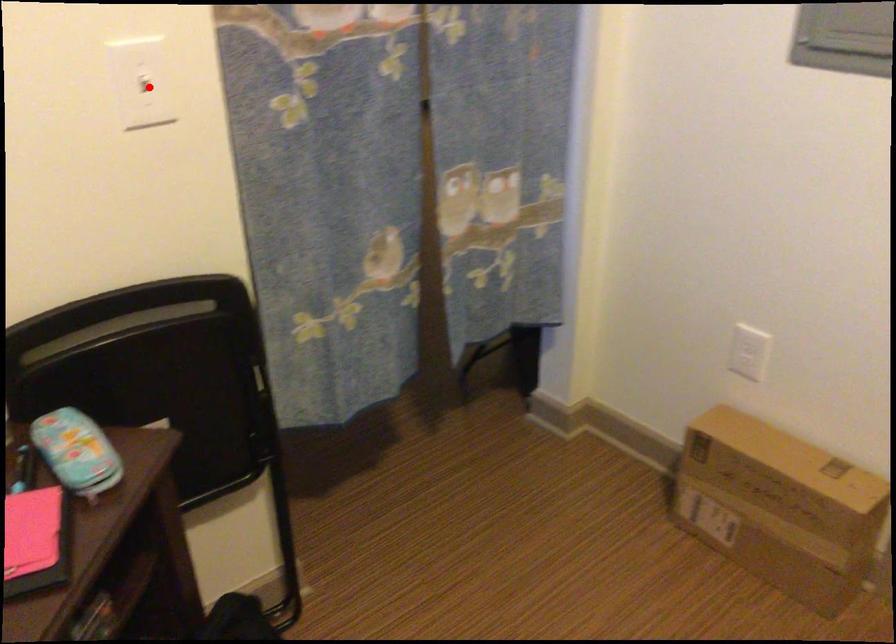
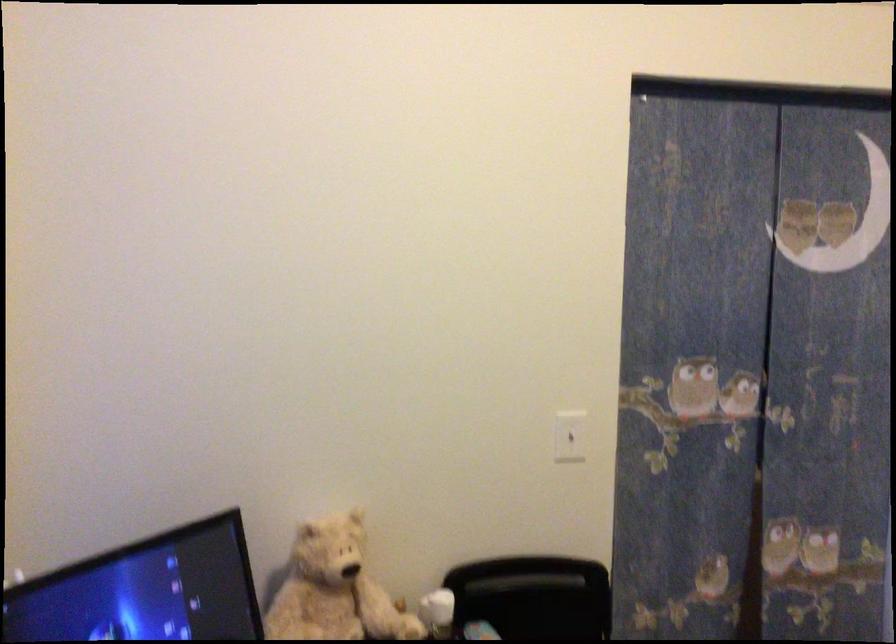
Question: I am providing you with two images of the same scene from different viewpoints. A red point is marked on the first image. At the location where the point appears in image 1, is it still visible in image 2?

Choices:
 (A) Yes
 (B) No

Answer: (A)